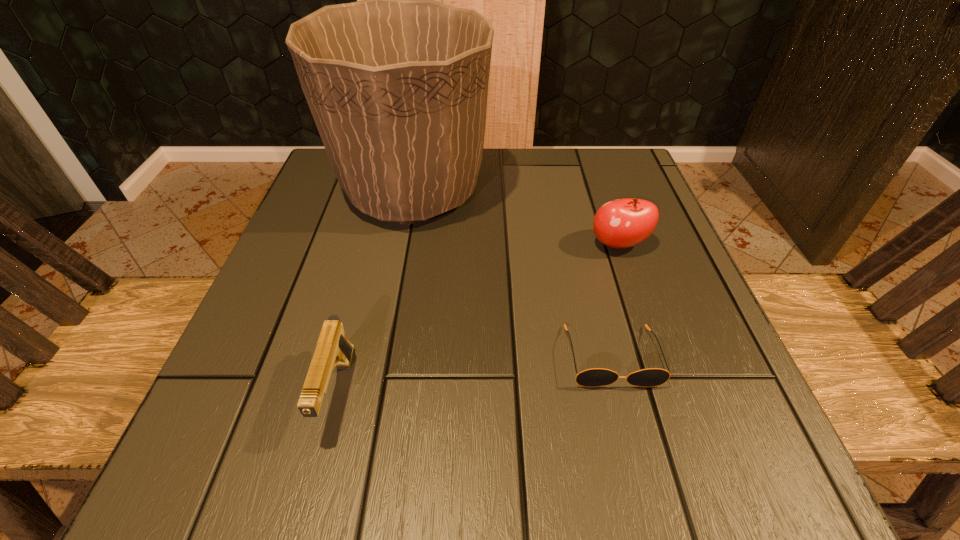
The width and height of the screenshot is (960, 540). I want to click on flowerpot, so click(x=397, y=84).

Find the location of `the second tallest object`. the second tallest object is located at coordinates (622, 223).

Identify the location of the third tallest object. Image resolution: width=960 pixels, height=540 pixels. (333, 349).

The height and width of the screenshot is (540, 960). I want to click on sunglasses, so [x=595, y=377].

Where is `vacant space located on the front of the tallest object`? The image size is (960, 540). vacant space located on the front of the tallest object is located at coordinates (368, 426).

The image size is (960, 540). What are the coordinates of `vacant space situated on the back of the apple` in the screenshot? It's located at tap(594, 173).

Where is `blank area located on the front-facing side of the sunglasses`? blank area located on the front-facing side of the sunglasses is located at coordinates (636, 453).

In order to click on object located at the far edge in this screenshot , I will do `click(397, 84)`.

Where is `object at the near edge`? object at the near edge is located at coordinates [x=333, y=349].

Locate an element on the screen. The width and height of the screenshot is (960, 540). flowerpot present at the left edge is located at coordinates (397, 84).